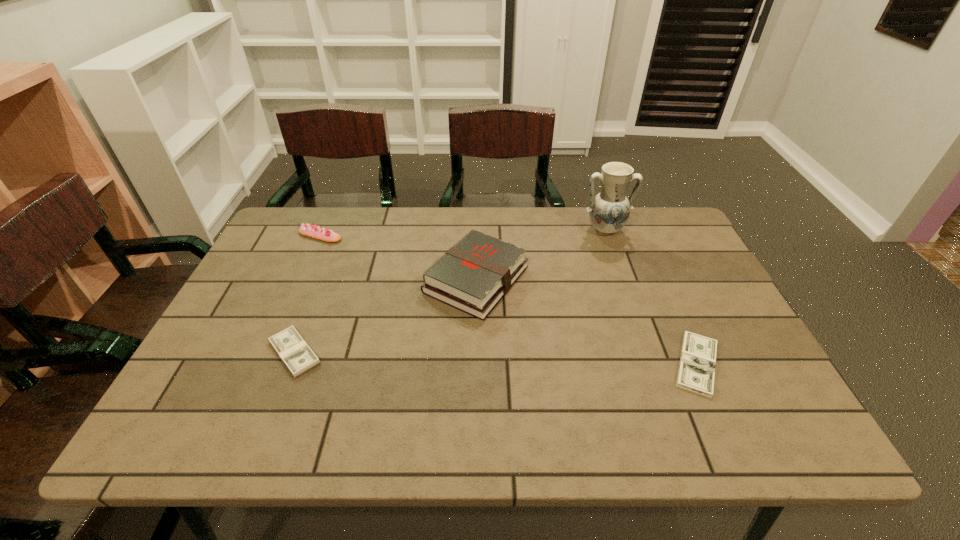
Where is `vacant space located on the right of the third tallest object`? vacant space located on the right of the third tallest object is located at coordinates (x=445, y=236).

Identify the location of vacant space located 0.250m on the right of the taller dollar. (431, 353).

The height and width of the screenshot is (540, 960). What are the coordinates of `vacant space located on the left of the right dollar` in the screenshot? It's located at (589, 364).

The width and height of the screenshot is (960, 540). I want to click on pottery located at the far edge, so point(609,210).

This screenshot has width=960, height=540. I want to click on hardback book located at the far edge, so click(473, 276).

Where is `eclair positioned at the far edge`? eclair positioned at the far edge is located at coordinates (309, 230).

Where is `eclair present at the left edge`? Image resolution: width=960 pixels, height=540 pixels. eclair present at the left edge is located at coordinates (309, 230).

Find the location of a particular element. This screenshot has height=540, width=960. dollar at the left edge is located at coordinates (298, 357).

At what (x,y) coordinates should I click in order to perform the action: click on object present at the right edge. Please return your answer as a coordinate pair (x, y). This screenshot has width=960, height=540. Looking at the image, I should click on (696, 373).

Locate an element on the screen. object located in the far left corner section of the desktop is located at coordinates (309, 230).